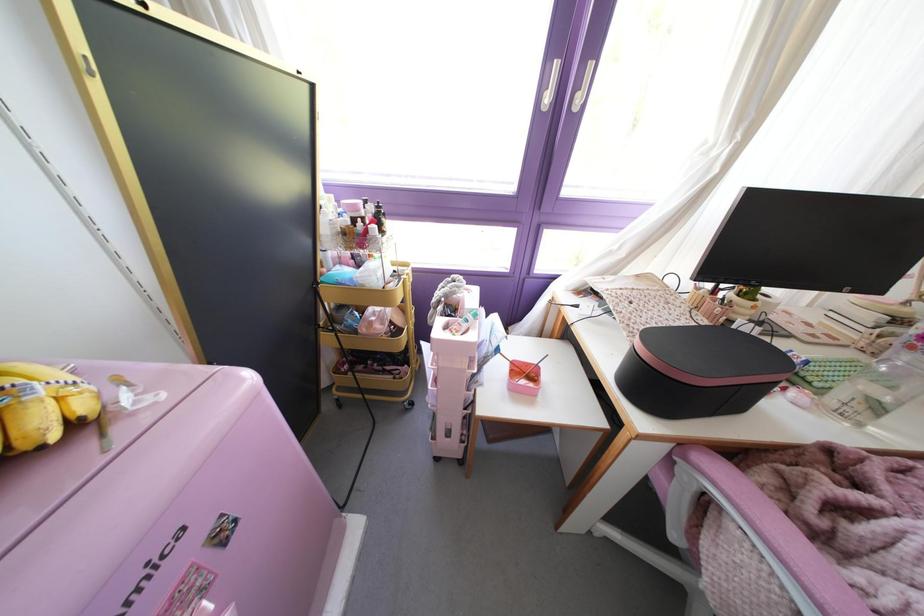
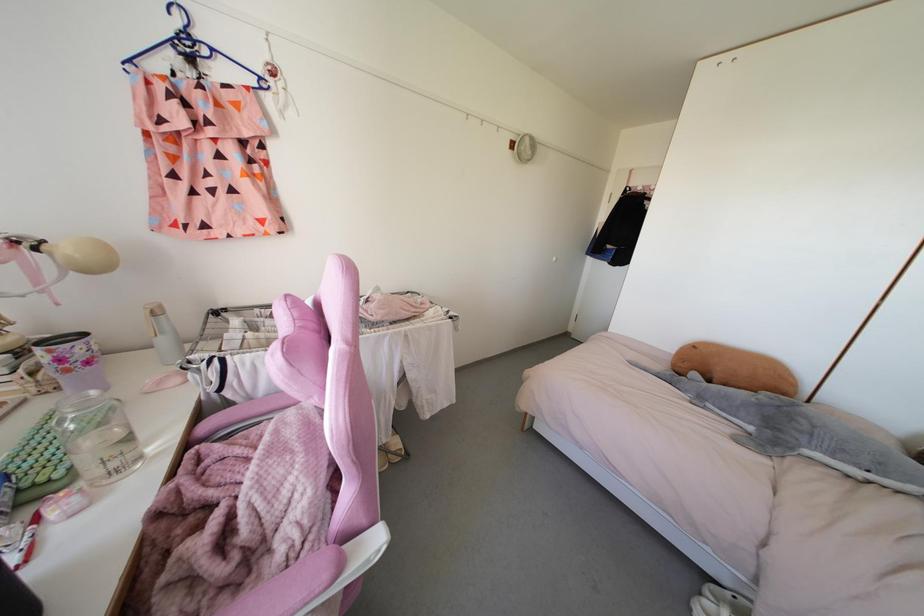
In the second image, find the point that corresponds to point (843, 541) in the first image.

(252, 543)